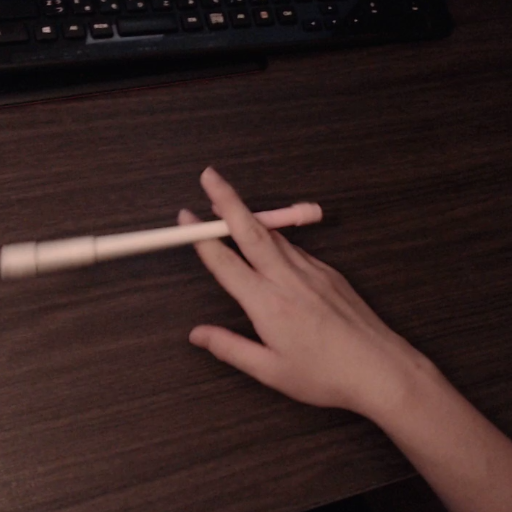
In order to click on brown table surface in this screenshot , I will do `click(105, 416)`, `click(117, 160)`.